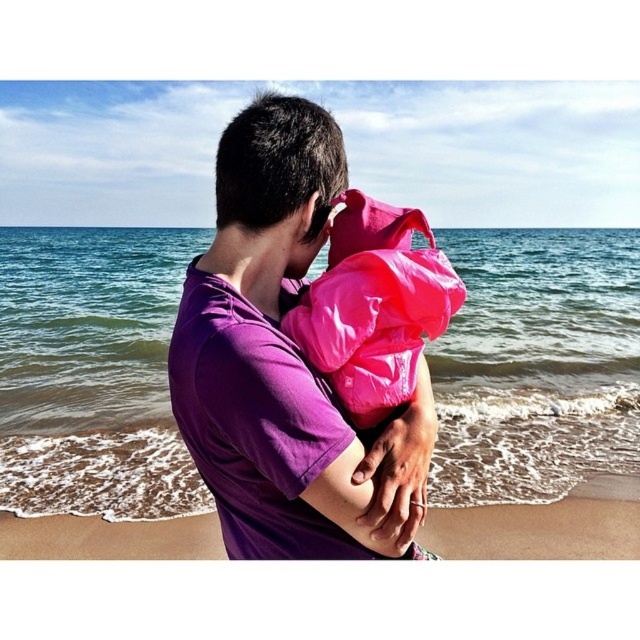
Who is more distant from viewer, (276, 396) or (160, 541)?

The point (160, 541) is behind.

I want to click on purple cotton shirt at center, so click(284, 362).

Which of these two, pink fabric at center or sandy beach at lower center, stands shorter?

Standing shorter between the two is sandy beach at lower center.

Can you confirm if pink fabric at center is wider than sandy beach at lower center?

Incorrect, pink fabric at center's width does not surpass sandy beach at lower center's.

Measure the distance between point [369,337] and camera.

A distance of 3.79 feet exists between point [369,337] and camera.

This screenshot has height=640, width=640. I want to click on pink fabric at center, so click(x=374, y=305).

Can you confirm if purple cotton shirt at center is positioned below pink fabric at center?

Correct, purple cotton shirt at center is located below pink fabric at center.

Who is more forward, (173, 397) or (456, 294)?

Point (173, 397)

Image resolution: width=640 pixels, height=640 pixels. Identify the location of purple cotton shirt at center. (284, 362).